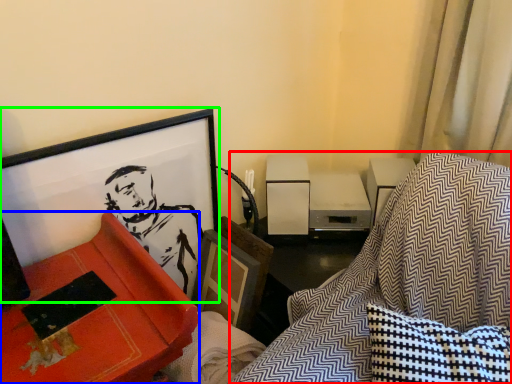
Question: Considering the real-world distances, which object is closest to swivel chair (highlighted by a red box)? furniture (highlighted by a blue box) or picture frame (highlighted by a green box).

Choices:
 (A) furniture
 (B) picture frame

Answer: (A)